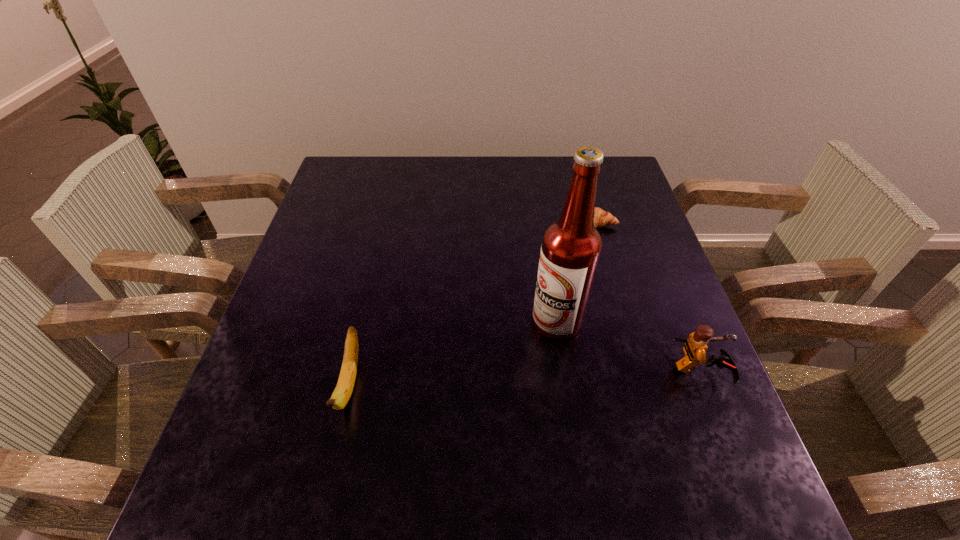
The image size is (960, 540). I want to click on free space located on the front-facing side of the pastry, so click(584, 264).

The height and width of the screenshot is (540, 960). Find the location of `vacant space located 0.100m on the label side of the alcohol`. vacant space located 0.100m on the label side of the alcohol is located at coordinates (510, 364).

At what (x,y) coordinates should I click in order to perform the action: click on free space located on the label side of the alcohol. Please return your answer as a coordinate pair (x, y). Looking at the image, I should click on (496, 376).

Identify the location of vacant space located on the label side of the alcohol. (468, 402).

You are a GUI agent. You are given a task and a screenshot of the screen. Output one action in this format:
    pyautogui.click(x=<x>, y=<y>)
    Task: Click on the object that is at the near edge
    The image size is (960, 540).
    Given the screenshot: What is the action you would take?
    pyautogui.click(x=344, y=388)

At what (x,y) coordinates should I click in order to perform the action: click on Lego positioned at the right edge. Please return your answer as a coordinate pair (x, y). Looking at the image, I should click on (695, 347).

Image resolution: width=960 pixels, height=540 pixels. In order to click on pastry positioned at the right edge in this screenshot , I will do `click(601, 218)`.

Where is `vacant space at the far edge`? The height and width of the screenshot is (540, 960). vacant space at the far edge is located at coordinates (424, 182).

In the image, there is a desktop. Where is `free space at the near edge`? free space at the near edge is located at coordinates (462, 423).

The image size is (960, 540). I want to click on blank space at the left edge of the desktop, so click(348, 250).